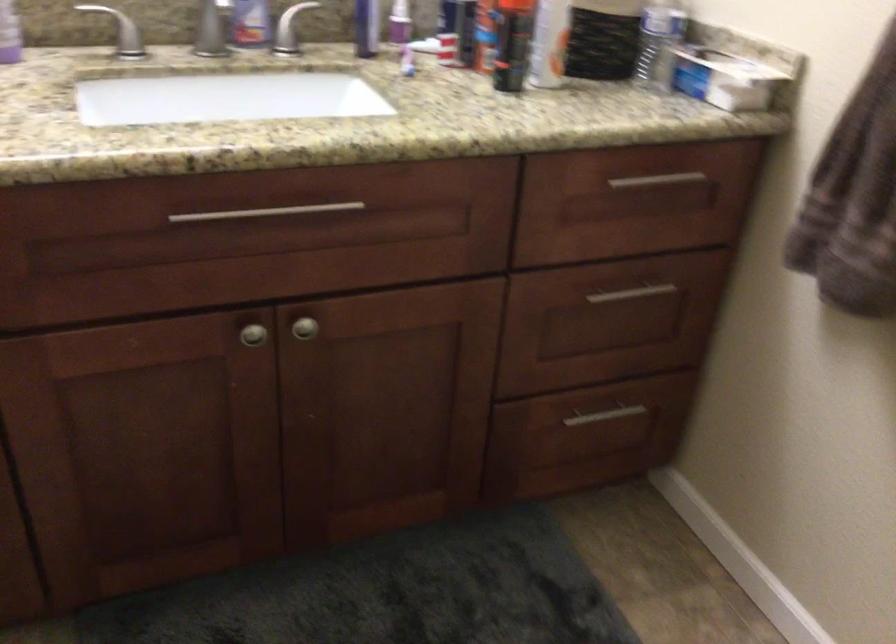
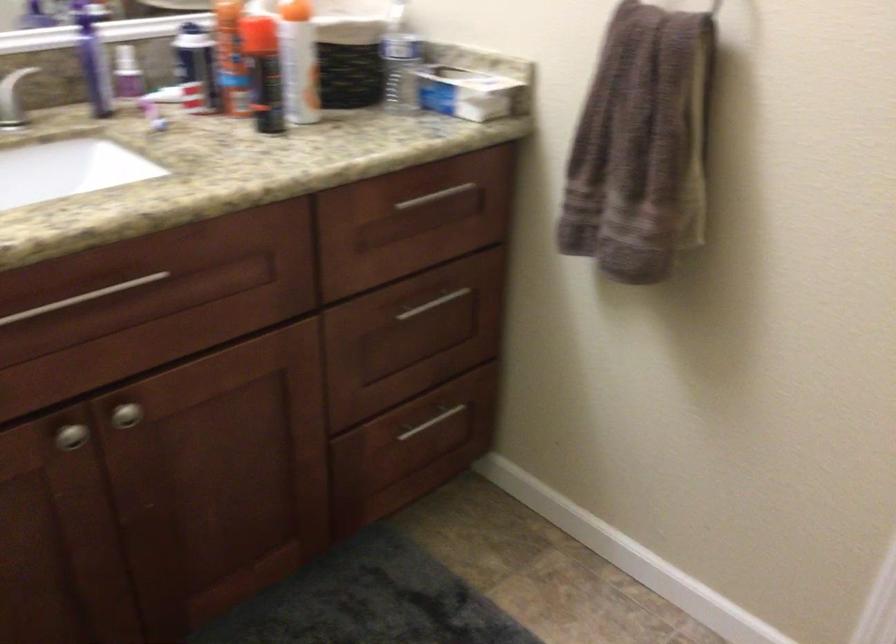
Where in the second image is the point corresponding to point 250,335 from the first image?

(71, 436)